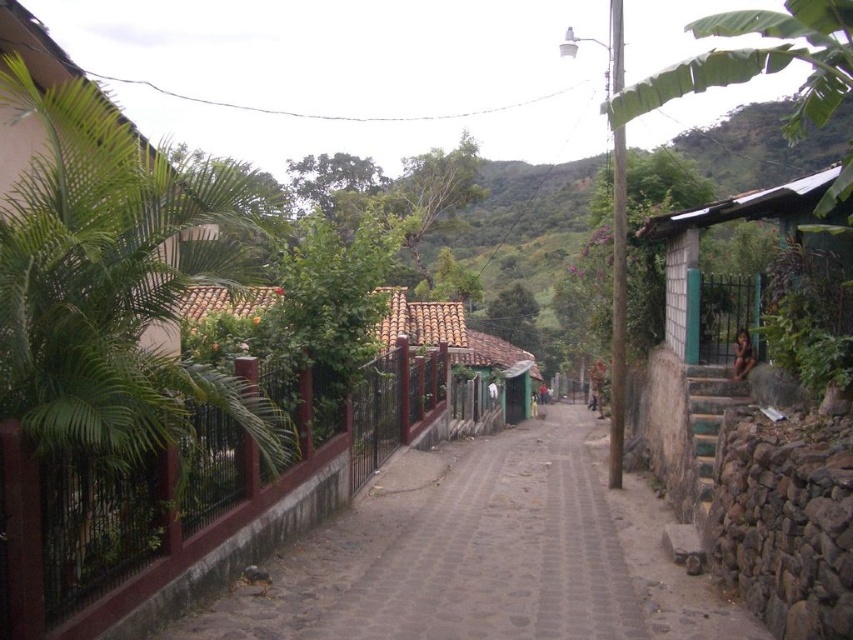
Question: Which point is farther from the camera taking this photo?

Choices:
 (A) (537, 493)
 (B) (686, 442)

Answer: (A)

Question: Does brown cobblestone path at center have a smaller size compared to green corrugated metal hut at right?

Choices:
 (A) yes
 (B) no

Answer: (A)

Question: Is brown cobblestone path at center behind green corrugated metal hut at right?

Choices:
 (A) yes
 (B) no

Answer: (B)

Question: Which of the following is the farthest from the observer?

Choices:
 (A) green corrugated metal hut at right
 (B) brown cobblestone path at center

Answer: (A)

Question: Is brown cobblestone path at center in front of green corrugated metal hut at right?

Choices:
 (A) yes
 (B) no

Answer: (A)